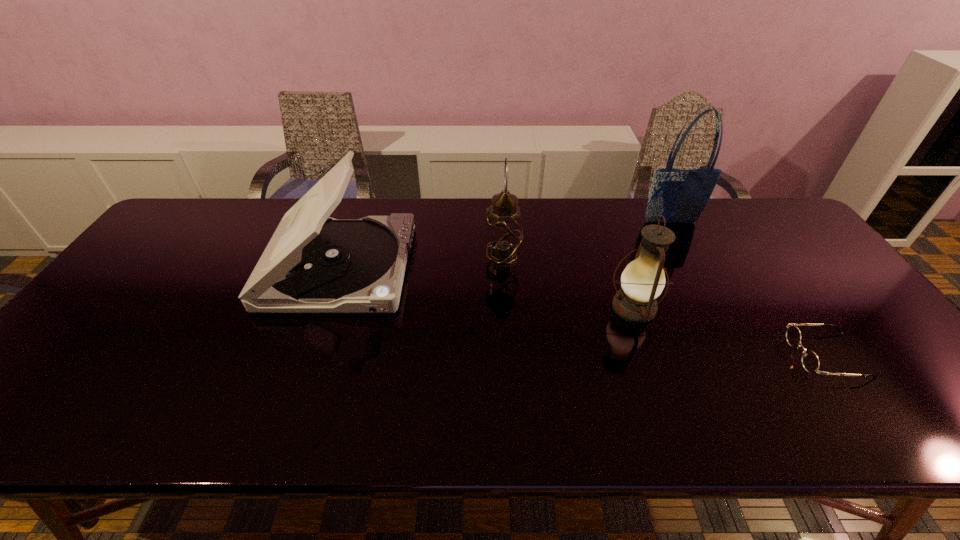
Identify the location of vacant space located on the front of the left oil lamp. (510, 383).

Identify the location of free space located on the control panel of the CD player. (539, 267).

Locate an element on the screen. vacant space situated on the left of the third object from right to left is located at coordinates (588, 308).

Where is `vacant space situated 0.320m on the lenses of the shortest object`? The height and width of the screenshot is (540, 960). vacant space situated 0.320m on the lenses of the shortest object is located at coordinates (659, 355).

I want to click on vacant space located on the lenses of the shortest object, so click(650, 355).

Where is `vacant space located on the lenses of the shortest object`? vacant space located on the lenses of the shortest object is located at coordinates (680, 355).

Locate an element on the screen. The width and height of the screenshot is (960, 540). shopping bag that is at the far edge is located at coordinates (680, 196).

Image resolution: width=960 pixels, height=540 pixels. What are the coordinates of `CD player situated at the far edge` in the screenshot? It's located at (313, 263).

This screenshot has width=960, height=540. Identify the location of object located in the right edge section of the desktop. (810, 361).

Locate an element on the screen. vacant space at the far edge of the desktop is located at coordinates (744, 230).